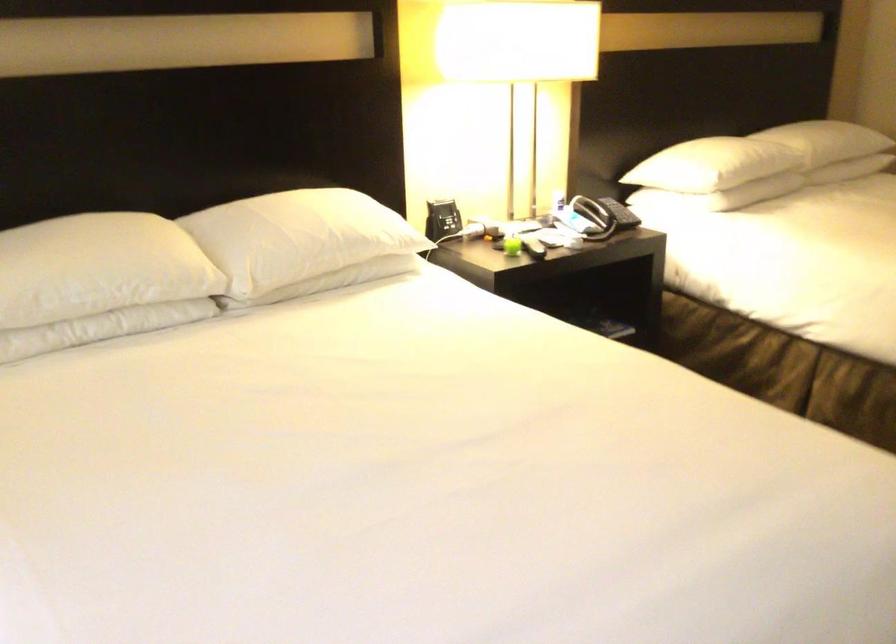
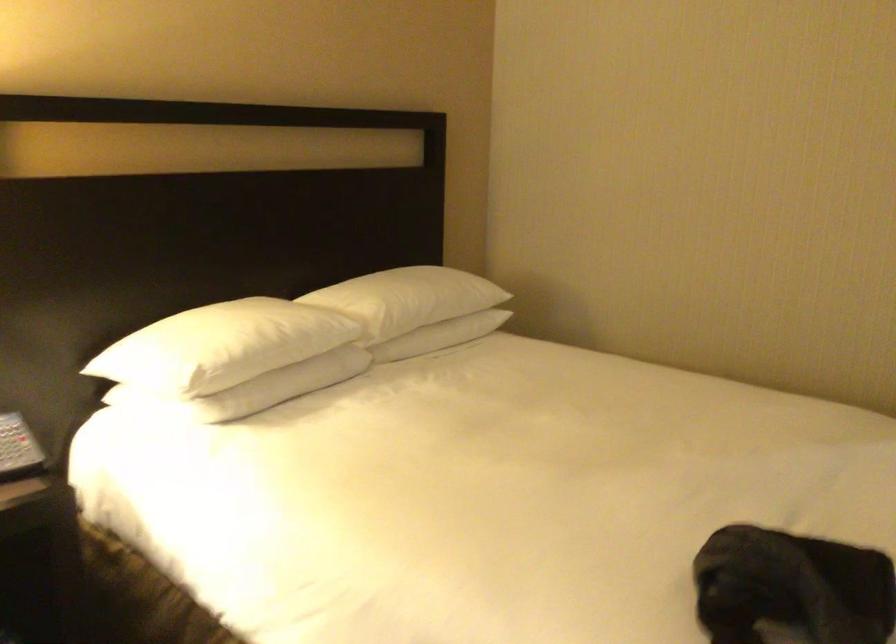
In the second image, find the point that corresponds to point (745, 166) in the first image.

(253, 355)